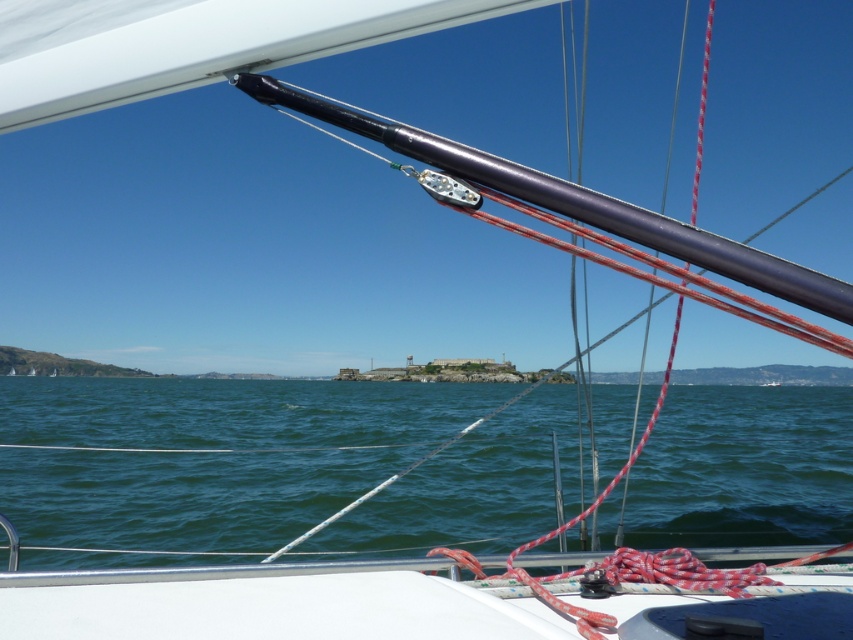
Measure the distance between point (18, 522) and camera.

They are 32.33 feet apart.

Who is more distant from viewer, (700,492) or (825,330)?

Point (700,492)

The width and height of the screenshot is (853, 640). In order to click on green water at center in this screenshot , I will do `click(209, 454)`.